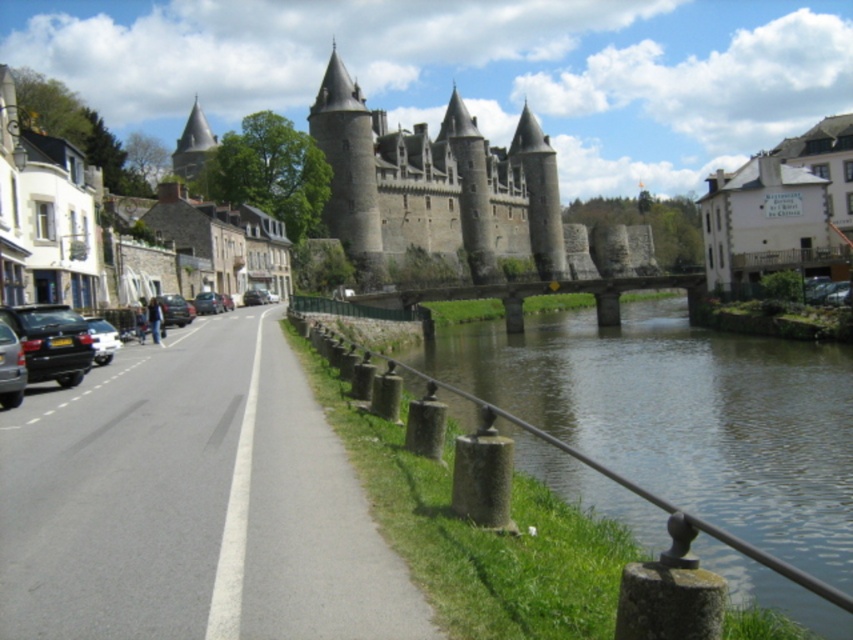
You are a tourist standing on the paved road near the river. You see the white painted building at upper right and the silver metallic car at left. Which object is closer to you?

The white painted building at upper right is closer to you because the silver metallic car at left is behind it.

You are a tour guide leading a group to the castle. You see a silver metallic car at left and a metallic silver car at road center. Your group wants to cross the road safely. Is there enough space between the two cars to walk through?

The distance between the silver metallic car at left and the metallic silver car at road center is 94.30 feet, so yes, there is enough space to walk through safely between them.